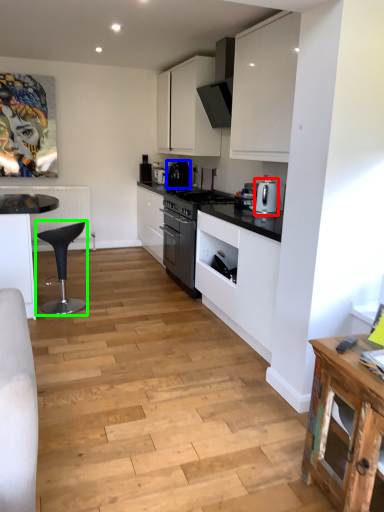
Question: Estimate the real-world distances between objects in this image. Which object is farther from kitchen appliance (highlighted by a red box), kitchen appliance (highlighted by a blue box) or bar stool (highlighted by a green box)?

Choices:
 (A) kitchen appliance
 (B) bar stool

Answer: (A)